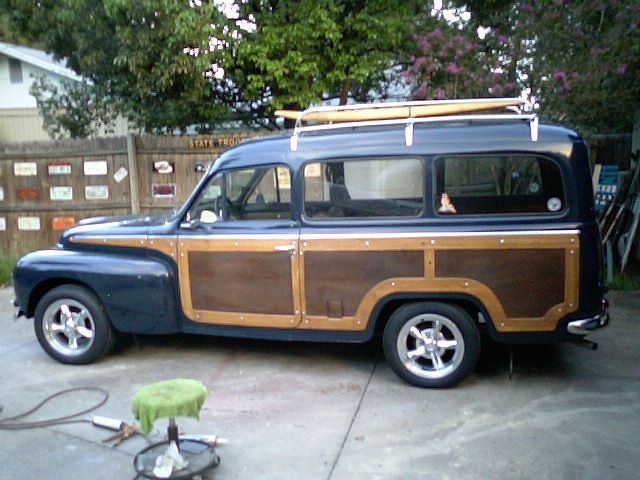
At what (x,y) coordinates should I click in order to perform the action: click on dark brown wood. Please return your answer as a coordinate pair (x, y). The width and height of the screenshot is (640, 480). Looking at the image, I should click on (221, 284), (329, 280), (534, 280).